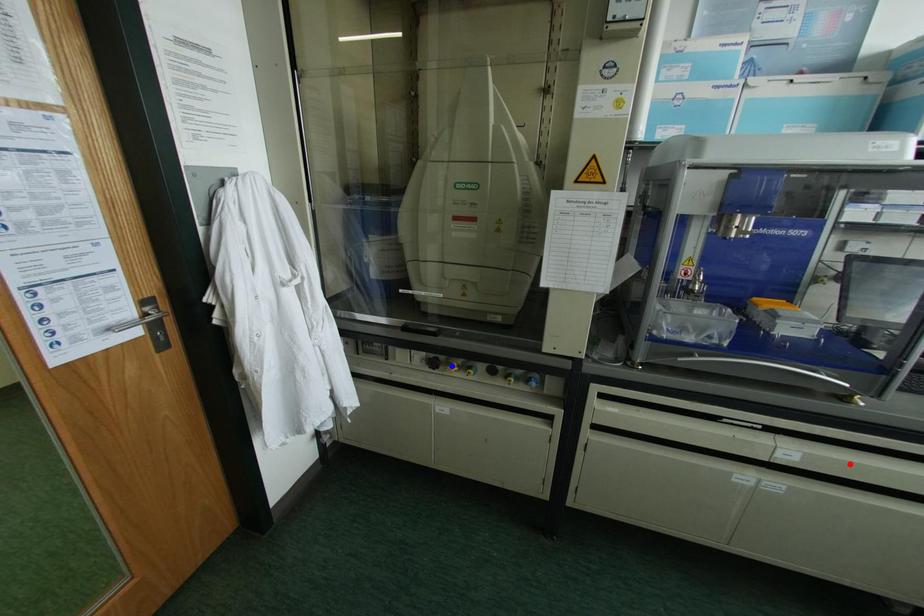
Question: Two points are marked on the image. Which point is closer to the camera?

Choices:
 (A) Blue point is closer.
 (B) Red point is closer.

Answer: (B)